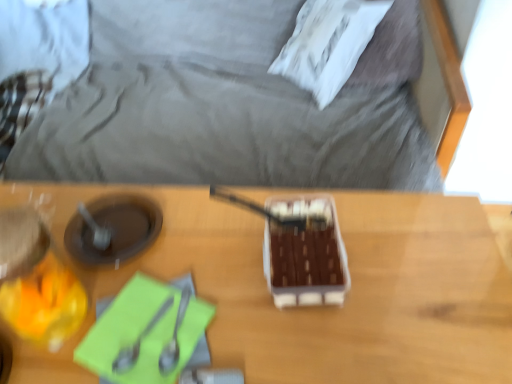
Where is `free location to the right of green matte notepad at lower left`? The height and width of the screenshot is (384, 512). free location to the right of green matte notepad at lower left is located at coordinates [269, 323].